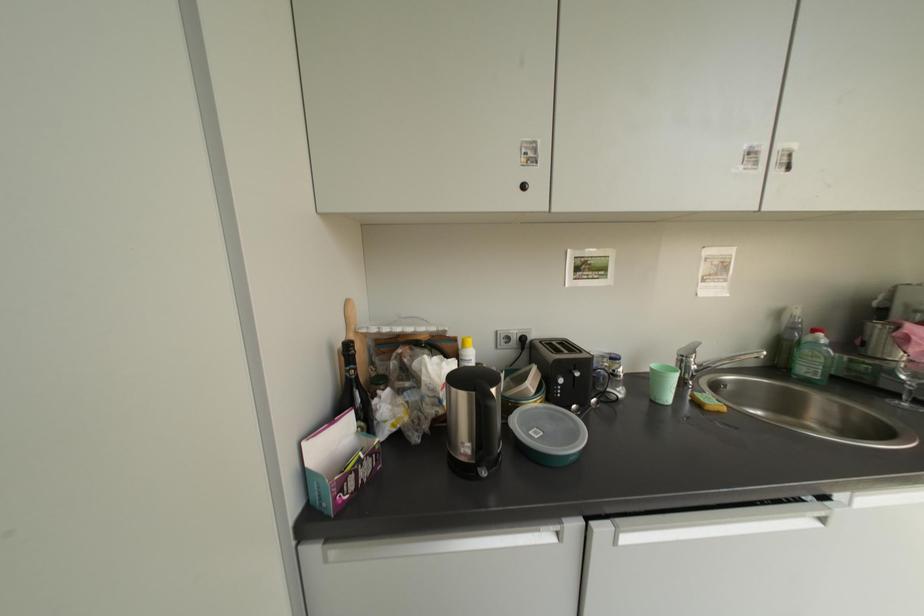
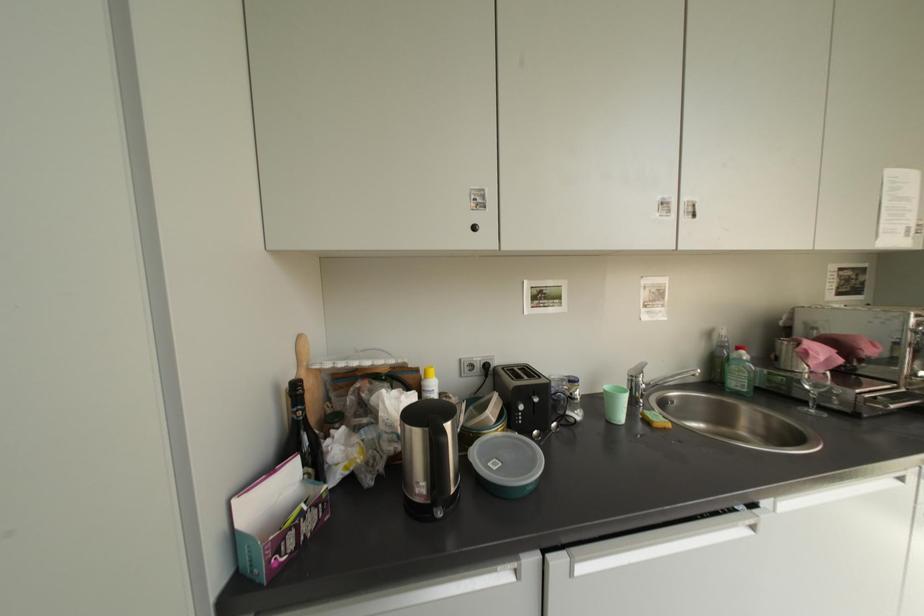
Question: Based on the continuous images, in which direction is the camera rotating? Reply with the corresponding letter.

Choices:
 (A) Left
 (B) Right
 (C) Up
 (D) Down

Answer: (B)